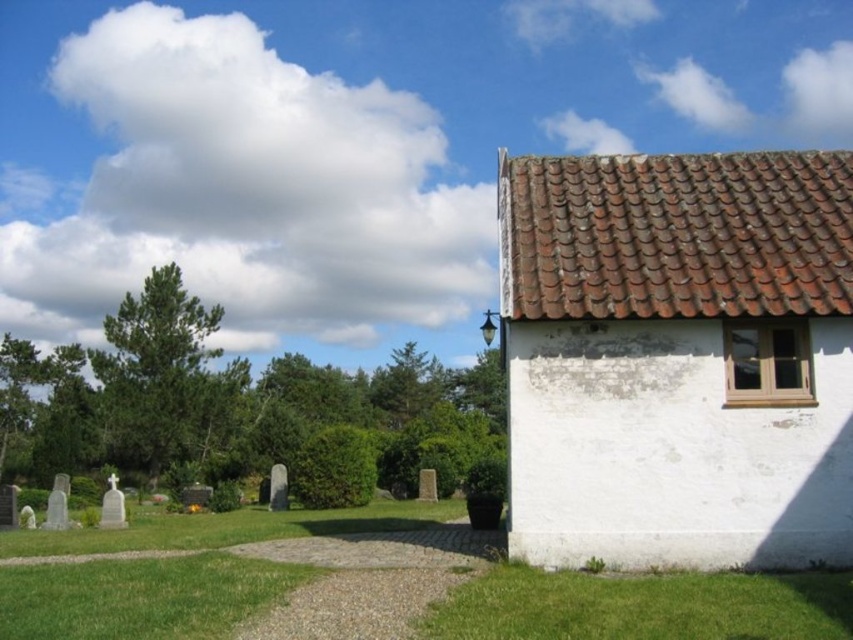
You are standing at the entrance of the rural scene and notice two patches of green grass at lower right and green grass at lower left. Which grass patch is taller?

The green grass at lower right is taller than the green grass at lower left.

You are standing at the entrance of the rural scene and see the gravel path leading to the building. There are two patches of green grass at lower right and green grass at lower left. Which grass patch is located to the right of the other?

The green grass at lower right is positioned on the right side of green grass at lower left.

You are standing at the entrance of the rural scene and notice two patches of green grass at lower right and green grass at lower left. Which grass patch is wider?

The green grass at lower right is wider than the green grass at lower left.